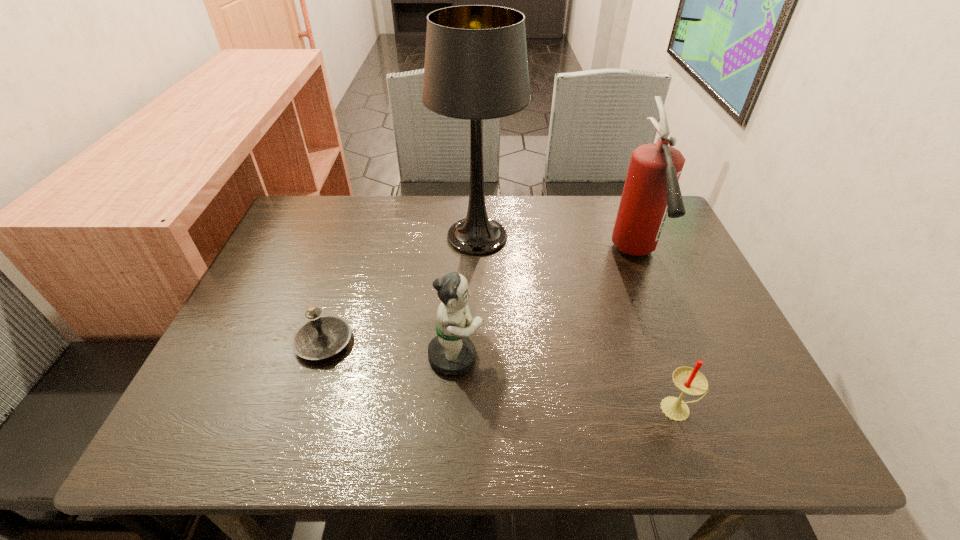
Image resolution: width=960 pixels, height=540 pixels. I want to click on vacant space at the far edge, so click(x=406, y=213).

You are a GUI agent. You are given a task and a screenshot of the screen. Output one action in this format:
    pyautogui.click(x=<x>, y=<y>)
    Task: Click on the free region at the near edge
    This screenshot has height=540, width=960.
    Given the screenshot: What is the action you would take?
    pyautogui.click(x=659, y=409)

The image size is (960, 540). In the image, there is a desktop. Identify the location of vacant space at the left edge. (224, 386).

Where is `vacant region at the right edge of the desktop`? The width and height of the screenshot is (960, 540). vacant region at the right edge of the desktop is located at coordinates click(x=700, y=295).

This screenshot has height=540, width=960. I want to click on blank area at the far left corner, so click(339, 208).

Locate an element on the screen. empty location between the fourth tallest object and the second tallest object is located at coordinates (657, 332).

At what (x,y) coordinates should I click in order to perform the action: click on empty space that is in between the second tallest object and the taller candle. Please return your answer as a coordinate pair (x, y). This screenshot has width=960, height=540. Looking at the image, I should click on (657, 332).

Identify the location of empty location between the third shortest object and the fourth shortest object. (545, 306).

Locate an element on the screen. The image size is (960, 540). vacant area that lies between the left candle and the figurine is located at coordinates (390, 349).

Where is `free space between the fire extinguisher and the farther candle`? free space between the fire extinguisher and the farther candle is located at coordinates (479, 298).